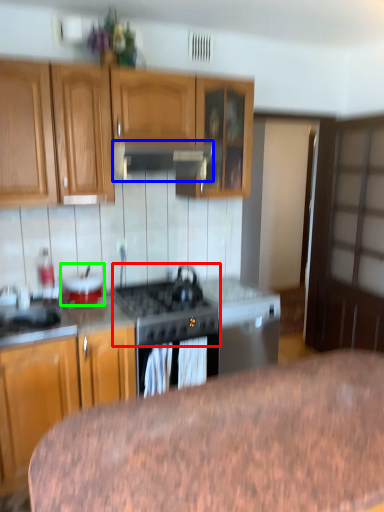
Question: Which object is positioned farthest from gas stove (highlighted by a red box)? Select from exhaust hood (highlighted by a blue box) and appliance (highlighted by a green box).

Choices:
 (A) exhaust hood
 (B) appliance

Answer: (A)